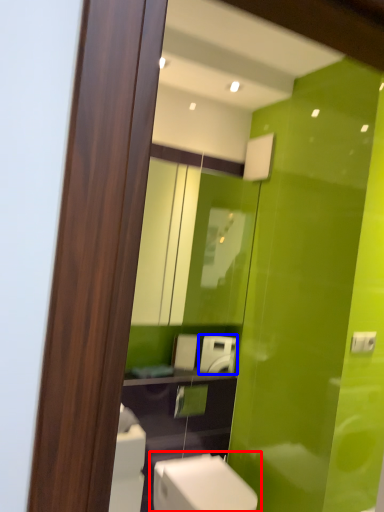
Question: Which of the following is the farthest to the observer, toilet (highlighted by a red box) or appliance (highlighted by a blue box)?

Choices:
 (A) toilet
 (B) appliance

Answer: (B)